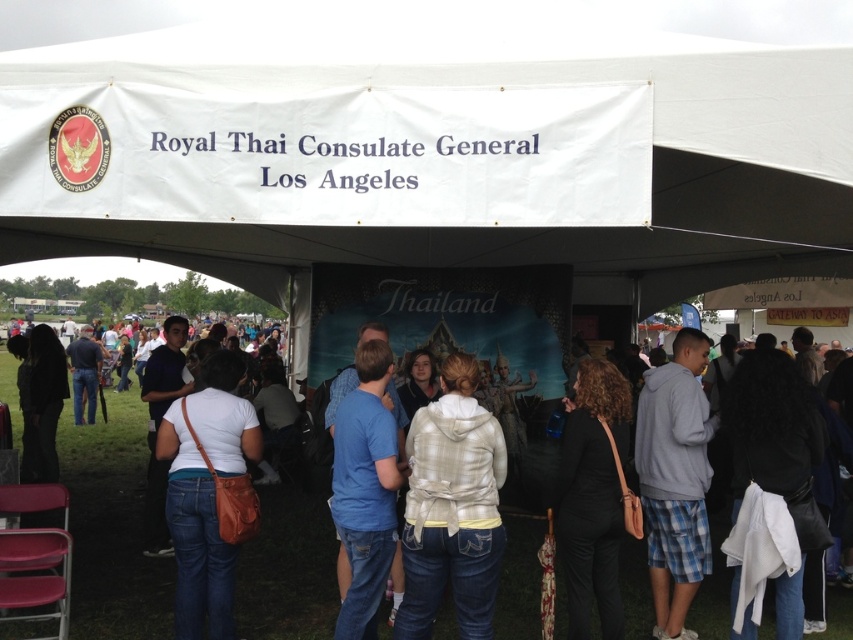
Question: Considering the relative positions of white fabric canopy at upper center and black matte pants at lower center in the image provided, where is white fabric canopy at upper center located with respect to black matte pants at lower center?

Choices:
 (A) below
 (B) above

Answer: (B)

Question: Is gray fleece hoodie at center to the right of black matte pants at lower center from the viewer's perspective?

Choices:
 (A) no
 (B) yes

Answer: (B)

Question: Which of the following is the farthest from the observer?

Choices:
 (A) (355, 356)
 (B) (9, 369)
 (C) (466, 506)

Answer: (B)

Question: Is white fabric canopy at upper center to the right of black matte pants at lower center from the viewer's perspective?

Choices:
 (A) yes
 (B) no

Answer: (A)

Question: Which point is closer to the camera taking this photo?

Choices:
 (A) (589, 483)
 (B) (166, 442)
 (C) (653, 474)

Answer: (A)

Question: Among these points, which one is nearest to the camera?

Choices:
 (A) (91, 547)
 (B) (189, 417)

Answer: (B)